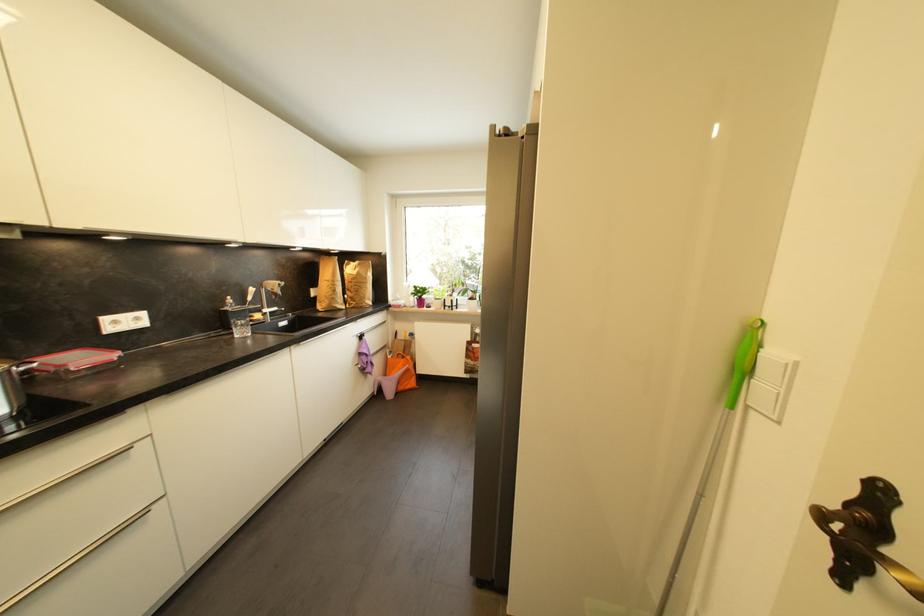
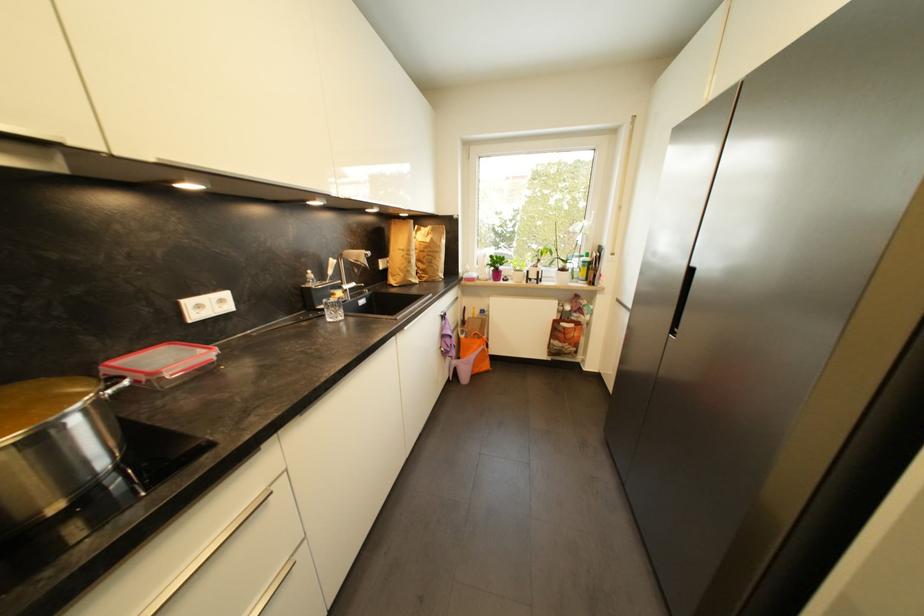
Question: I am providing you with two images of the same scene from different viewpoints. Please identify which objects are invisible in image2.

Choices:
 (A) metal pot handle
 (B) white cabinet edge
 (C) brown paper bag
 (D) none of these

Answer: (D)